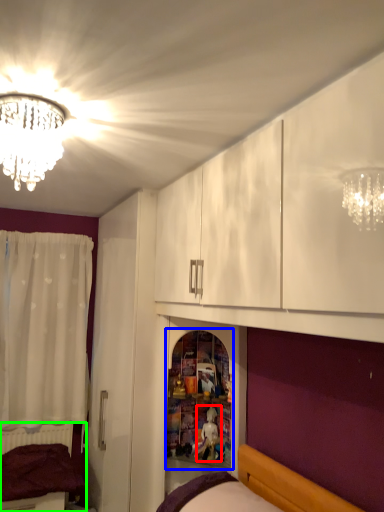
Question: Based on their relative distances, which object is farther from toy (highlighted by a red box)? Choose from shelf (highlighted by a blue box) and bed (highlighted by a green box).

Choices:
 (A) shelf
 (B) bed

Answer: (B)